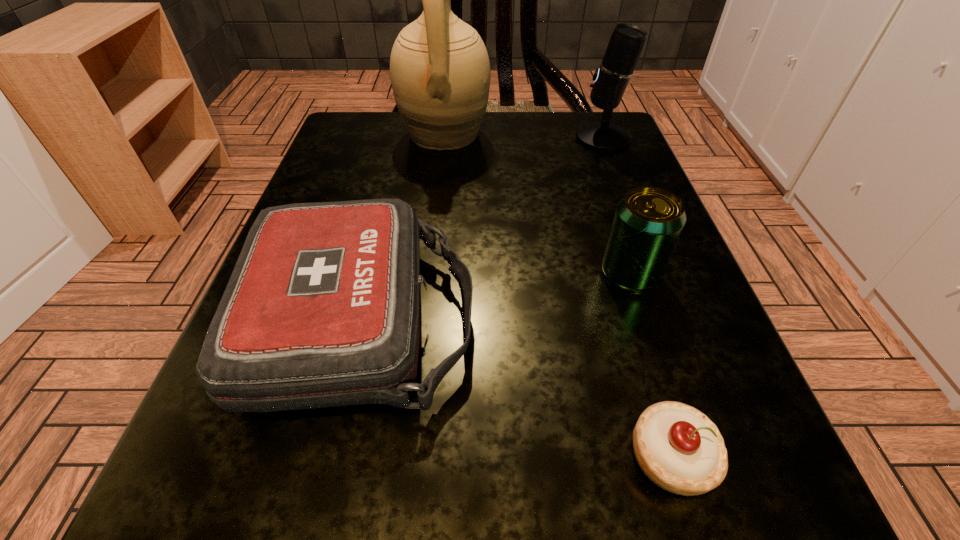
Find the location of `pitcher located at the far edge`. pitcher located at the far edge is located at coordinates (440, 73).

Where is `microphone that is at the far edge`? Image resolution: width=960 pixels, height=540 pixels. microphone that is at the far edge is located at coordinates (627, 41).

Locate an element on the screen. object that is at the near edge is located at coordinates (679, 448).

At what (x,y) coordinates should I click in order to perform the action: click on pitcher at the left edge. Please return your answer as a coordinate pair (x, y). Looking at the image, I should click on (440, 73).

I want to click on the first-aid kit situated at the left edge, so click(x=322, y=309).

You are a GUI agent. You are given a task and a screenshot of the screen. Output one action in this format:
    pyautogui.click(x=<x>, y=<y>)
    Task: Click on the microphone that is at the right edge
    The image size is (960, 540).
    Given the screenshot: What is the action you would take?
    pyautogui.click(x=627, y=41)

The height and width of the screenshot is (540, 960). Identify the location of beer can at the right edge. (648, 221).

Where is `pastry that is at the right edge`? This screenshot has width=960, height=540. pastry that is at the right edge is located at coordinates (679, 448).

In order to click on object that is positioned at the far left corner in this screenshot , I will do `click(440, 73)`.

Find the location of `object present at the far right corner`. object present at the far right corner is located at coordinates (627, 41).